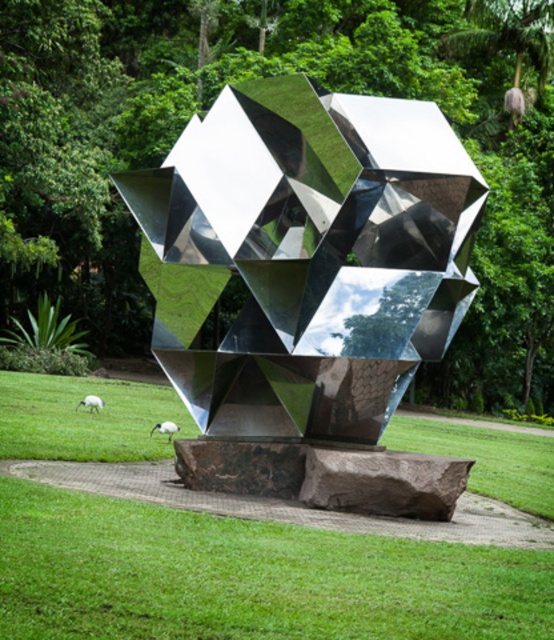
Question: Is polished metallic sculpture at center positioned behind green grass at center?

Choices:
 (A) no
 (B) yes

Answer: (B)

Question: Considering the real-world distances, which object is farthest from the green grass at center?

Choices:
 (A) white fluffy sheep at lower left
 (B) polished metallic sculpture at center
 (C) white feathered bird at lower left

Answer: (C)

Question: Estimate the real-world distances between objects in this image. Which object is closer to the white fluffy sheep at lower left?

Choices:
 (A) polished metallic sculpture at center
 (B) white feathered bird at lower left
 (C) green grass at center

Answer: (B)

Question: Is white feathered bird at lower left above white fluffy sheep at lower left?

Choices:
 (A) no
 (B) yes

Answer: (B)

Question: In this image, where is polished metallic sculpture at center located relative to green grass at center?

Choices:
 (A) below
 (B) above

Answer: (B)

Question: Which object appears closest to the camera in this image?

Choices:
 (A) green grass at center
 (B) polished metallic sculpture at center
 (C) white feathered bird at lower left

Answer: (A)